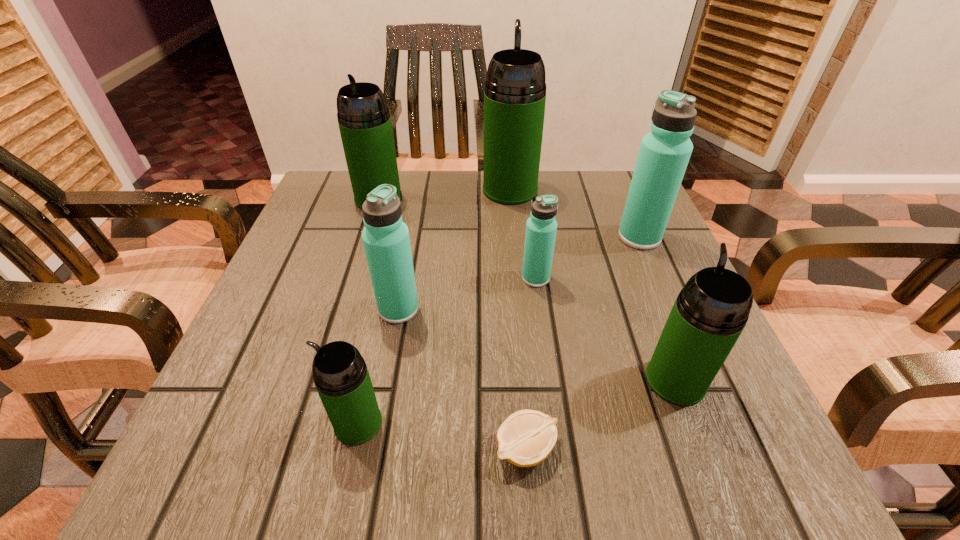
Find the location of a particular element. This screenshot has width=960, height=540. the smallest green thermos bottle is located at coordinates (341, 377).

The image size is (960, 540). Find the location of `lemon`. lemon is located at coordinates (526, 438).

You are a GUI agent. You are given a task and a screenshot of the screen. Output one action in this format:
    pyautogui.click(x=<x>, y=<y>)
    Task: Click on the shortest object
    The width and height of the screenshot is (960, 540).
    Given the screenshot: What is the action you would take?
    pyautogui.click(x=526, y=438)

You are a GUI agent. You are given a task and a screenshot of the screen. Output one action in this format:
    pyautogui.click(x=<x>, y=<y>)
    Task: Click on the free space located from the spout of the second biggest green thermos bottle
    The height and width of the screenshot is (540, 960).
    Given the screenshot: What is the action you would take?
    click(x=356, y=271)

The width and height of the screenshot is (960, 540). Identify the location of vacant space located 0.230m on the back of the rightmost aqua thermos bottle. (612, 172).

The image size is (960, 540). In order to click on vacant space located 0.240m from the spout of the rightmost green thermos bottle in this screenshot , I will do `click(630, 259)`.

Find the location of a particular element. This screenshot has width=960, height=540. vacant space located from the spout of the rightmost green thermos bottle is located at coordinates (613, 216).

This screenshot has width=960, height=540. I want to click on vacant space located from the spout of the rightmost green thermos bottle, so click(625, 247).

Locate an element on the screen. The image size is (960, 540). free point located on the back of the third nearest thermos bottle is located at coordinates (412, 238).

Find the location of `vacant region located 0.320m on the left of the second farthest aqua thermos bottle`. vacant region located 0.320m on the left of the second farthest aqua thermos bottle is located at coordinates (354, 278).